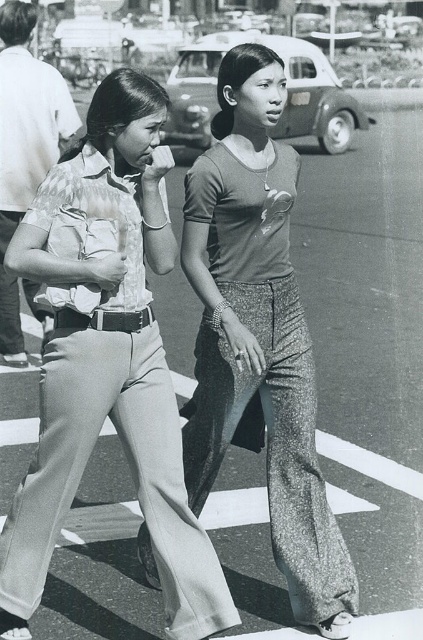
Can you confirm if matte beige pants at center is positioned to the left of matte gray pants at center?

Indeed, matte beige pants at center is positioned on the left side of matte gray pants at center.

Find the location of a particular element. The width and height of the screenshot is (423, 640). matte beige pants at center is located at coordinates (109, 369).

This screenshot has height=640, width=423. Identify the location of matte beige pants at center. (109, 369).

You are a GUI agent. You are given a task and a screenshot of the screen. Output one action in this format:
    pyautogui.click(x=<x>, y=<y>)
    Task: Click on the matte beige pants at center
    The image size is (423, 640).
    Given the screenshot: What is the action you would take?
    pyautogui.click(x=109, y=369)